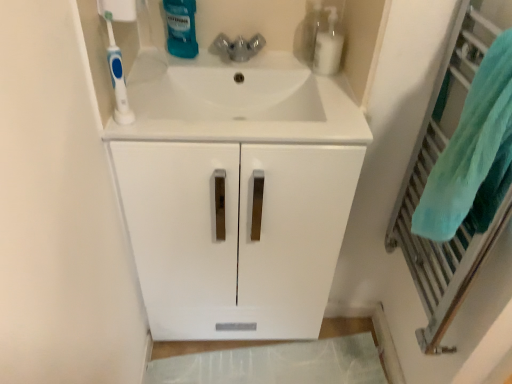
The image size is (512, 384). Find the location of `clear plastic bottle at upper right, the 1th cleaning product positioned from the right`. clear plastic bottle at upper right, the 1th cleaning product positioned from the right is located at coordinates (328, 44).

You are a GUI agent. You are given a task and a screenshot of the screen. Output one action in this format:
    pyautogui.click(x=<x>, y=<y>)
    Task: Click on the white matte cabinet at center
    
    Given the screenshot: What is the action you would take?
    pyautogui.click(x=238, y=195)

Where is `teal soft towel at right`? This screenshot has width=512, height=384. teal soft towel at right is located at coordinates (473, 154).

I want to click on teal fabric towel at right, so click(x=429, y=173).

At what (x,y) coordinates should I click in order to perform the action: click on white glossy sink at center. Please return your answer as a coordinate pair (x, y). The image size is (512, 384). Looking at the image, I should click on (238, 103).

I want to click on clear plastic bottle at upper right, the 1th cleaning product positioned from the right, so click(x=328, y=44).

Could you tell me if teal fabric towel at right is turned towards translucent plastic mouthwash at upper center, the first cleaning product positioned from the left?

No.

From a real-world perspective, relative to translucent plastic mouthwash at upper center, the first cleaning product positioned from the left, is teal fabric towel at right vertically above or below?

In terms of real-world spatial position, teal fabric towel at right is below translucent plastic mouthwash at upper center, the first cleaning product positioned from the left.

Is point (494, 1) farther from viewer compared to point (168, 27)?

No, it is in front of (168, 27).

Is teal fabric towel at right with translucent plastic mouthwash at upper center, which is the second cleaning product in right-to-left order?

No, teal fabric towel at right is not with translucent plastic mouthwash at upper center, which is the second cleaning product in right-to-left order.

Can you tell me how much blue plastic toothbrush at upper left and teal fabric towel at right differ in facing direction?

The angular difference between blue plastic toothbrush at upper left and teal fabric towel at right is 89 degrees.

Does blue plastic toothbrush at upper left appear on the right side of teal fabric towel at right?

No.

Is blue plastic toothbrush at upper left surrounding teal fabric towel at right?

No, teal fabric towel at right is located outside of blue plastic toothbrush at upper left.

Can you confirm if blue plastic toothbrush at upper left is bigger than teal fabric towel at right?

No, blue plastic toothbrush at upper left is not bigger than teal fabric towel at right.

From the image's perspective, does clear plastic bottle at upper right, marked as the second cleaning product in a left-to-right arrangement, appear higher than white glossy sink at center?

Yes, from the image's perspective, clear plastic bottle at upper right, marked as the second cleaning product in a left-to-right arrangement, is above white glossy sink at center.

From a real-world perspective, between clear plastic bottle at upper right, the 1th cleaning product positioned from the right, and white glossy sink at center, who is vertically higher?

clear plastic bottle at upper right, the 1th cleaning product positioned from the right, from a real-world perspective.

Is clear plastic bottle at upper right, marked as the second cleaning product in a left-to-right arrangement, oriented towards white glossy sink at center?

Yes, clear plastic bottle at upper right, marked as the second cleaning product in a left-to-right arrangement, is aimed at white glossy sink at center.

Considering the positions of objects teal fabric towel at right and teal soft towel at right in the image provided, who is more to the right, teal fabric towel at right or teal soft towel at right?

Positioned to the right is teal fabric towel at right.

Considering the relative sizes of teal fabric towel at right and teal soft towel at right in the image provided, is teal fabric towel at right shorter than teal soft towel at right?

Incorrect, the height of teal fabric towel at right does not fall short of that of teal soft towel at right.

Who is smaller, teal fabric towel at right or teal soft towel at right?

teal soft towel at right is smaller.

Who is shorter, teal soft towel at right or white matte cabinet at center?

With less height is teal soft towel at right.

Is teal soft towel at right closer to camera compared to white matte cabinet at center?

Yes, teal soft towel at right is in front of white matte cabinet at center.

Does teal soft towel at right have a larger size compared to white matte cabinet at center?

No, teal soft towel at right is not bigger than white matte cabinet at center.

Is there a large distance between teal soft towel at right and white matte cabinet at center?

No, teal soft towel at right is in close proximity to white matte cabinet at center.

Who is bigger, teal soft towel at right or translucent plastic mouthwash at upper center, which is the second cleaning product in right-to-left order?

With larger size is teal soft towel at right.

Is teal soft towel at right far away from translucent plastic mouthwash at upper center, which is the second cleaning product in right-to-left order?

No, teal soft towel at right is not far from translucent plastic mouthwash at upper center, which is the second cleaning product in right-to-left order.

From the image's perspective, is teal soft towel at right beneath translucent plastic mouthwash at upper center, the first cleaning product positioned from the left?

Yes, from the image's perspective, teal soft towel at right is beneath translucent plastic mouthwash at upper center, the first cleaning product positioned from the left.

Consider the image. Are teal soft towel at right and teal fabric towel at right making contact?

No, teal soft towel at right is not making contact with teal fabric towel at right.

From a real-world perspective, is teal soft towel at right beneath teal fabric towel at right?

No, from a real-world perspective, teal soft towel at right is not under teal fabric towel at right.

Does point (487, 203) come in front of point (460, 21)?

Yes, point (487, 203) is closer to viewer.

You are a GUI agent. You are given a task and a screenshot of the screen. Output one action in this format:
    pyautogui.click(x=<x>, y=<y>)
    Task: Click on the screen door to the right of translucent plastic mouthwash at upper center, which is the second cleaning product in right-to-left order
    The height and width of the screenshot is (384, 512).
    Given the screenshot: What is the action you would take?
    pyautogui.click(x=429, y=173)

Find the location of a particular element. screen door located underneath the blue plastic toothbrush at upper left (from a real-world perspective) is located at coordinates (429, 173).

When comparing their distances from translucent plastic mouthwash at upper center, the first cleaning product positioned from the left, does teal soft towel at right or teal fabric towel at right seem closer?

teal fabric towel at right is closer to translucent plastic mouthwash at upper center, the first cleaning product positioned from the left.

When comparing their distances from white matte cabinet at center, does teal fabric towel at right or blue plastic toothbrush at upper left seem further?

The object further to white matte cabinet at center is blue plastic toothbrush at upper left.

When comparing their distances from teal fabric towel at right, does clear plastic bottle at upper right, marked as the second cleaning product in a left-to-right arrangement, or translucent plastic mouthwash at upper center, the first cleaning product positioned from the left, seem further?

The object further to teal fabric towel at right is translucent plastic mouthwash at upper center, the first cleaning product positioned from the left.

From the image, which object appears to be nearer to teal soft towel at right, white matte cabinet at center or teal fabric towel at right?

teal fabric towel at right is positioned closer to the anchor teal soft towel at right.

Considering their positions, is white glossy sink at center positioned further to blue plastic toothbrush at upper left than white matte cabinet at center?

white matte cabinet at center.

Estimate the real-world distances between objects in this image. Which object is closer to white glossy sink at center, teal fabric towel at right or clear plastic bottle at upper right, the 1th cleaning product positioned from the right?

Among the two, clear plastic bottle at upper right, the 1th cleaning product positioned from the right, is located nearer to white glossy sink at center.

Estimate the real-world distances between objects in this image. Which object is further from teal fabric towel at right, clear plastic bottle at upper right, marked as the second cleaning product in a left-to-right arrangement, or teal soft towel at right?

clear plastic bottle at upper right, marked as the second cleaning product in a left-to-right arrangement.

From the image, which object appears to be farther from teal soft towel at right, clear plastic bottle at upper right, the 1th cleaning product positioned from the right, or translucent plastic mouthwash at upper center, which is the second cleaning product in right-to-left order?

translucent plastic mouthwash at upper center, which is the second cleaning product in right-to-left order, lies further to teal soft towel at right than the other object.

The height and width of the screenshot is (384, 512). Find the location of `bath towel between white matte cabinet at center and teal fabric towel at right from left to right`. bath towel between white matte cabinet at center and teal fabric towel at right from left to right is located at coordinates (473, 154).

The width and height of the screenshot is (512, 384). What are the coordinates of `sink that lies between blue plastic toothbrush at upper left and white matte cabinet at center from top to bottom` in the screenshot? It's located at (238, 103).

The height and width of the screenshot is (384, 512). I want to click on toothbrush that lies between translucent plastic mouthwash at upper center, the first cleaning product positioned from the left, and white matte cabinet at center from top to bottom, so tap(117, 74).

Where is `sink between clear plastic bottle at upper right, marked as the second cleaning product in a left-to-right arrangement, and white matte cabinet at center vertically`? The height and width of the screenshot is (384, 512). sink between clear plastic bottle at upper right, marked as the second cleaning product in a left-to-right arrangement, and white matte cabinet at center vertically is located at coordinates (238, 103).